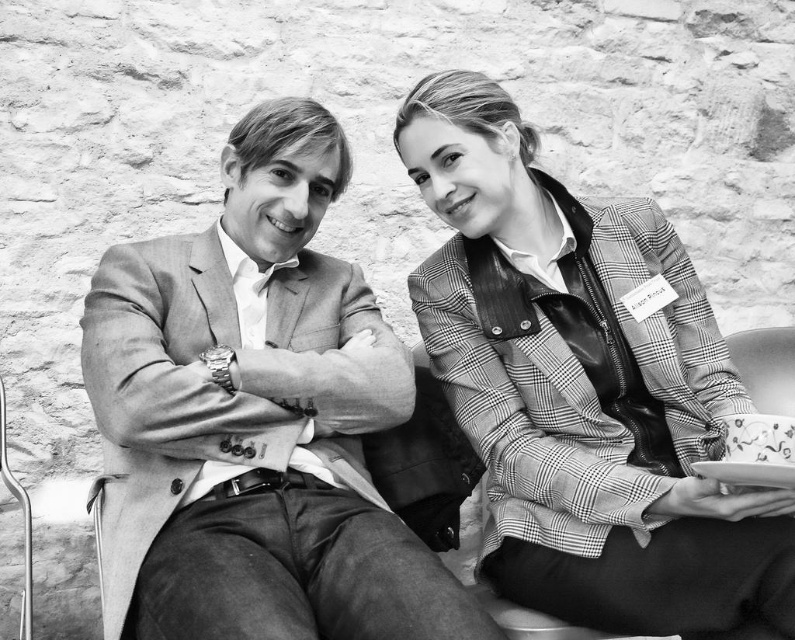
Question: Can you confirm if light brown leather jacket at center is smaller than checkered fabric blazer at center?

Choices:
 (A) yes
 (B) no

Answer: (B)

Question: Which of the following is the farthest from the observer?

Choices:
 (A) (673, 560)
 (B) (370, 369)

Answer: (B)

Question: Can you confirm if light brown leather jacket at center is positioned below checkered fabric blazer at center?

Choices:
 (A) yes
 (B) no

Answer: (A)

Question: Which object is closer to the camera taking this photo?

Choices:
 (A) checkered fabric blazer at center
 (B) light brown leather jacket at center

Answer: (B)

Question: Is light brown leather jacket at center behind checkered fabric blazer at center?

Choices:
 (A) no
 (B) yes

Answer: (A)